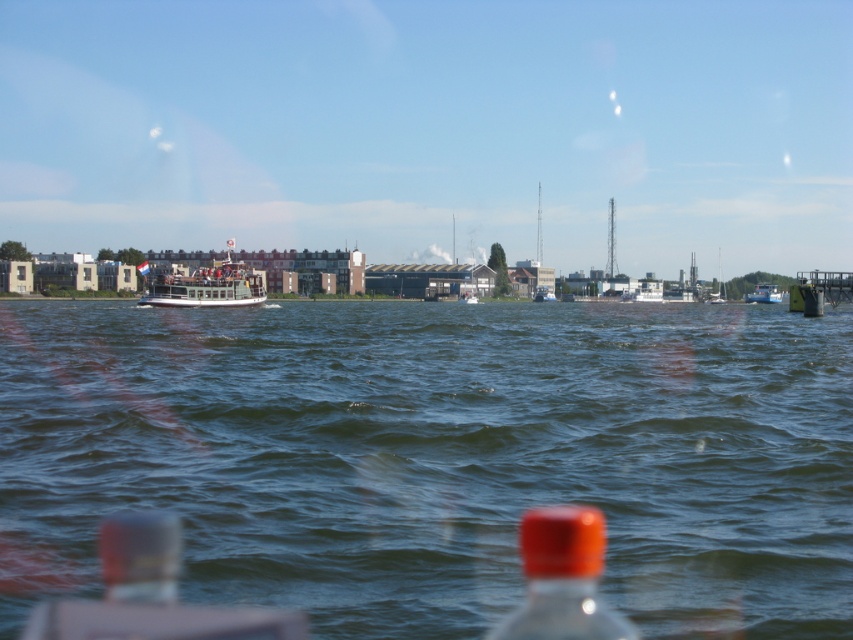
Question: Observing the image, what is the correct spatial positioning of greenish-blue water at center in reference to white wooden ferry at center?

Choices:
 (A) left
 (B) right

Answer: (B)

Question: Which object is farther from the camera taking this photo?

Choices:
 (A) greenish-blue water at center
 (B) white wooden ferry at center
 (C) blue matte boat at center
 (D) translucent plastic bottle at lower center

Answer: (C)

Question: Is greenish-blue water at center behind translucent plastic bottle at lower center?

Choices:
 (A) no
 (B) yes

Answer: (B)

Question: Considering the real-world distances, which object is farthest from the white wooden ferry at center?

Choices:
 (A) blue matte boat at center
 (B) translucent plastic bottle at lower center
 (C) greenish-blue water at center

Answer: (B)

Question: Among these objects, which one is nearest to the camera?

Choices:
 (A) greenish-blue water at center
 (B) white wooden ferry at center
 (C) translucent plastic bottle at lower center

Answer: (C)

Question: Can you confirm if translucent plastic bottle at lower center is positioned above white wooden ferry at center?

Choices:
 (A) yes
 (B) no

Answer: (B)